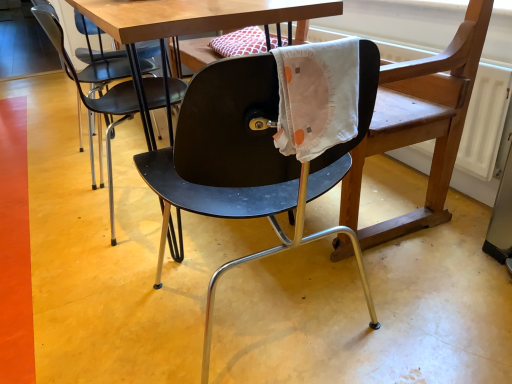
This screenshot has height=384, width=512. What are the coordinates of `free region under matte black chair at center, marked as the 1th chair in a right-to-left arrangement (from a real-world perspective)` in the screenshot? It's located at (263, 307).